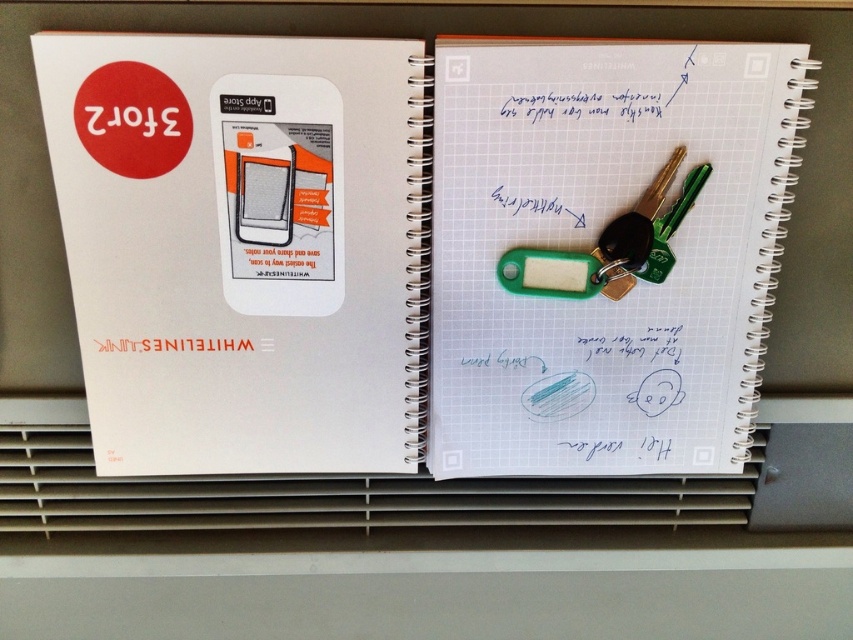
Does white grid paper at center appear under green plastic keychain at center?

Indeed, white grid paper at center is positioned under green plastic keychain at center.

Is point (639, 141) in front of point (699, 179)?

Yes, it is.

Describe the element at coordinates (604, 252) in the screenshot. I see `white grid paper at center` at that location.

Where is `white grid paper at center`? Image resolution: width=853 pixels, height=640 pixels. white grid paper at center is located at coordinates (604, 252).

Between white matte notebook at center and white grid paper at center, which one appears on the left side from the viewer's perspective?

Positioned to the left is white matte notebook at center.

Does point (387, 184) lie behind point (508, 150)?

Yes, point (387, 184) is farther from viewer.

Find the location of a particular element. The height and width of the screenshot is (640, 853). white matte notebook at center is located at coordinates (602, 250).

In order to click on white matte notebook at center in this screenshot , I will do `click(602, 250)`.

Between white matte notebook at center and green plastic keychain at center, which one has less height?

green plastic keychain at center is shorter.

Between point (525, 244) and point (560, 269), which one is positioned in front?

Point (525, 244) is in front.

Measure the distance between white matte notebook at center and camera.

white matte notebook at center is 27.80 inches from camera.

Image resolution: width=853 pixels, height=640 pixels. What are the coordinates of `white matte notebook at center` in the screenshot? It's located at (602, 250).